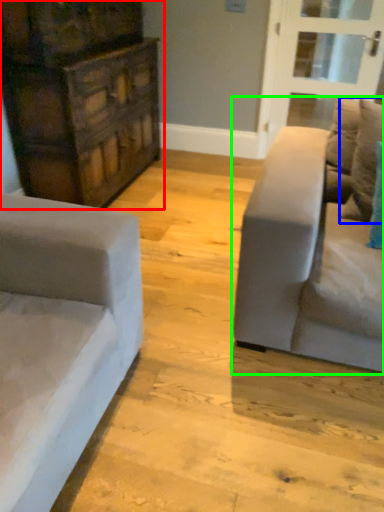
Question: Estimate the real-world distances between objects in this image. Which object is farther from dresser (highlighted by a red box), pillow (highlighted by a blue box) or studio couch (highlighted by a green box)?

Choices:
 (A) pillow
 (B) studio couch

Answer: (A)